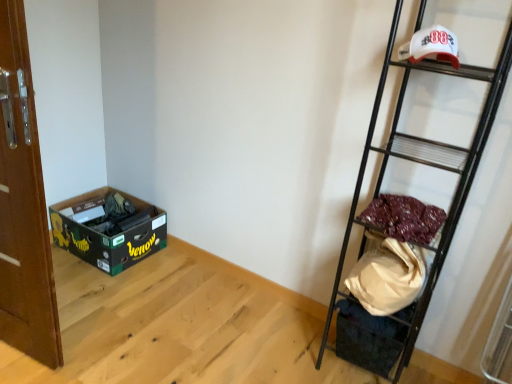
Describe the element at coordinates (424, 165) in the screenshot. The height and width of the screenshot is (384, 512). I see `black metal ladder at right` at that location.

You are a GUI agent. You are given a task and a screenshot of the screen. Output one action in this format:
    pyautogui.click(x=<x>, y=<y>)
    Task: Click on the brown wooden door at left
    This screenshot has height=384, width=512.
    Given the screenshot: What is the action you would take?
    pyautogui.click(x=23, y=205)

In order to face white matte baseball cap at upper right, should I rotate leftwards or rightwards?

Turn right approximately 22.701 degrees to face it.

At what (x,y) coordinates should I click in order to perform the action: click on black metal ladder at right. Please return your answer as a coordinate pair (x, y). This screenshot has height=384, width=512. Looking at the image, I should click on (424, 165).

Is green cardboard box at lower left to the right of black metal ladder at right from the viewer's perspective?

No, green cardboard box at lower left is not to the right of black metal ladder at right.

Is the depth of green cardboard box at lower left less than that of black metal ladder at right?

No.

Is green cardboard box at lower left facing towards black metal ladder at right?

Yes, green cardboard box at lower left is turned towards black metal ladder at right.

In terms of size, does green cardboard box at lower left appear bigger or smaller than black metal ladder at right?

Clearly, green cardboard box at lower left is smaller in size than black metal ladder at right.

Considering their positions, is green cardboard box at lower left located in front of or behind white matte baseball cap at upper right?

green cardboard box at lower left is positioned farther from the viewer than white matte baseball cap at upper right.

Can you confirm if green cardboard box at lower left is taller than white matte baseball cap at upper right?

Yes.

Could you tell me if green cardboard box at lower left is facing white matte baseball cap at upper right?

No, green cardboard box at lower left is not oriented towards white matte baseball cap at upper right.

Which is closer to the camera, (6, 319) or (97, 216)?

Point (6, 319).

From the picture: Is brown wooden door at left next to green cardboard box at lower left and touching it?

No, brown wooden door at left is not beside green cardboard box at lower left.

In the scene shown: From a real-world perspective, is brown wooden door at left under green cardboard box at lower left?

Incorrect, from a real-world perspective, brown wooden door at left is higher than green cardboard box at lower left.

From the image's perspective, is brown wooden door at left on top of green cardboard box at lower left?

Yes, from the image's perspective, brown wooden door at left is over green cardboard box at lower left.

Can you tell me how much green cardboard box at lower left and brown wooden door at left differ in facing direction?

83.3 degrees separate the facing orientations of green cardboard box at lower left and brown wooden door at left.

Would you say brown wooden door at left is part of green cardboard box at lower left's contents?

That's incorrect, brown wooden door at left is not inside green cardboard box at lower left.

Which object is positioned more to the left, green cardboard box at lower left or brown wooden door at left?

From the viewer's perspective, brown wooden door at left appears more on the left side.

Is white matte baseball cap at upper right far away from white fabric bag at lower right?

white matte baseball cap at upper right is near white fabric bag at lower right, not far away.

Is white fabric bag at lower right completely or partially inside white matte baseball cap at upper right?

Actually, white fabric bag at lower right is outside white matte baseball cap at upper right.

Based on the photo, who is bigger, white matte baseball cap at upper right or white fabric bag at lower right?

With larger size is white fabric bag at lower right.

Between point (453, 56) and point (393, 358), which one is positioned behind?

The point (393, 358) is farther.

From the picture: Based on their positions, is white fabric bag at lower right located to the left or right of brown wooden door at left?

In the image, white fabric bag at lower right appears on the right side of brown wooden door at left.

Is white fabric bag at lower right oriented towards brown wooden door at left?

No.

Is white fabric bag at lower right in contact with brown wooden door at left?

No, white fabric bag at lower right is not beside brown wooden door at left.

Does white fabric bag at lower right come behind brown wooden door at left?

Yes, the depth of white fabric bag at lower right is greater than that of brown wooden door at left.

Is black metal ladder at right shorter than white matte baseball cap at upper right?

In fact, black metal ladder at right may be taller than white matte baseball cap at upper right.

From a real-world perspective, which is physically below, black metal ladder at right or white matte baseball cap at upper right?

In real-world perspective, black metal ladder at right is lower.

Considering the sizes of black metal ladder at right and white matte baseball cap at upper right in the image, is black metal ladder at right bigger or smaller than white matte baseball cap at upper right?

Clearly, black metal ladder at right is larger in size than white matte baseball cap at upper right.

The width and height of the screenshot is (512, 384). I want to click on baseball hat behind the black metal ladder at right, so click(x=431, y=46).

The image size is (512, 384). In order to click on ladder on the right of green cardboard box at lower left in this screenshot , I will do `click(424, 165)`.

Locate an element on the screen. The image size is (512, 384). baseball hat in front of the green cardboard box at lower left is located at coordinates (431, 46).

Estimate the real-world distances between objects in this image. Which object is closer to maroon fabric at right, white fabric bag at lower right or brown wooden door at left?

white fabric bag at lower right.

When comparing their distances from brown wooden door at left, does black metal ladder at right or green cardboard box at lower left seem closer?

green cardboard box at lower left is positioned closer to the anchor brown wooden door at left.

When comparing their distances from white matte baseball cap at upper right, does white fabric bag at lower right or brown wooden door at left seem closer?

white fabric bag at lower right lies closer to white matte baseball cap at upper right than the other object.

Looking at the image, which one is located closer to white fabric bag at lower right, maroon fabric at right or white matte baseball cap at upper right?

maroon fabric at right is positioned closer to the anchor white fabric bag at lower right.

Estimate the real-world distances between objects in this image. Which object is closer to black metal ladder at right, green cardboard box at lower left or brown wooden door at left?

brown wooden door at left.

When comparing their distances from maroon fabric at right, does white matte baseball cap at upper right or green cardboard box at lower left seem further?

green cardboard box at lower left lies further to maroon fabric at right than the other object.

Estimate the real-world distances between objects in this image. Which object is further from white matte baseball cap at upper right, maroon fabric at right or black metal ladder at right?

maroon fabric at right.

Looking at the image, which one is located closer to white matte baseball cap at upper right, brown wooden door at left or maroon fabric at right?

maroon fabric at right is closer to white matte baseball cap at upper right.

Locate an element on the screen. The image size is (512, 384). ladder between maroon fabric at right and white fabric bag at lower right from top to bottom is located at coordinates (424, 165).

At what (x,y) coordinates should I click in order to perform the action: click on box located between brown wooden door at left and white matte baseball cap at upper right in the left-right direction. Please return your answer as a coordinate pair (x, y). The height and width of the screenshot is (384, 512). Looking at the image, I should click on tap(108, 228).

Locate an element on the screen. The height and width of the screenshot is (384, 512). storage box situated between green cardboard box at lower left and white matte baseball cap at upper right from left to right is located at coordinates (368, 338).

Find the location of `box between brown wooden door at left and white fabric bag at lower right in the horizontal direction`. box between brown wooden door at left and white fabric bag at lower right in the horizontal direction is located at coordinates (108, 228).